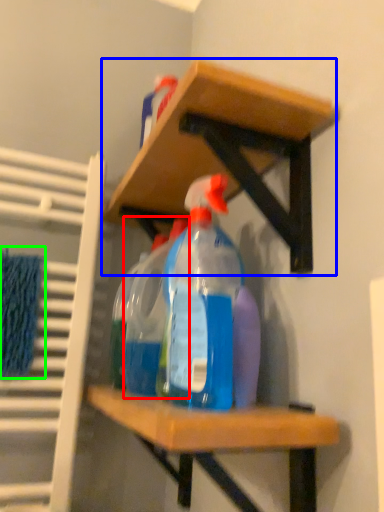
Question: Which object is the closest to the bottle (highlighted by a red box)? Choose among these: shelf (highlighted by a blue box) or bath towel (highlighted by a green box).

Choices:
 (A) shelf
 (B) bath towel

Answer: (A)